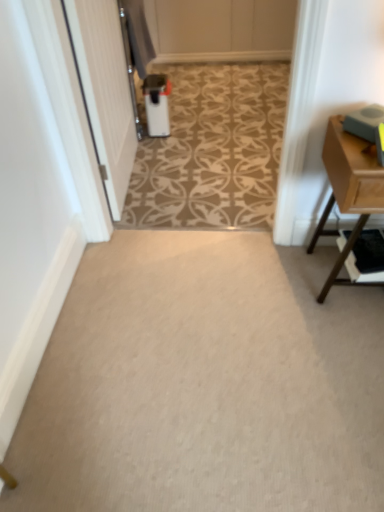
Question: In the image, is carpet at center positioned in front of or behind white glossy trash can at center?

Choices:
 (A) front
 (B) behind

Answer: (A)

Question: Is carpet at center taller or shorter than white glossy trash can at center?

Choices:
 (A) tall
 (B) short

Answer: (B)

Question: Which object is the farthest from the light brown wood table at right?

Choices:
 (A) white glossy trash can at center
 (B) carpet at center
 (C) wooden shelf at right

Answer: (A)

Question: Which object is the closest to the carpet at center?

Choices:
 (A) white glossy trash can at center
 (B) wooden shelf at right
 (C) light brown wood table at right

Answer: (B)